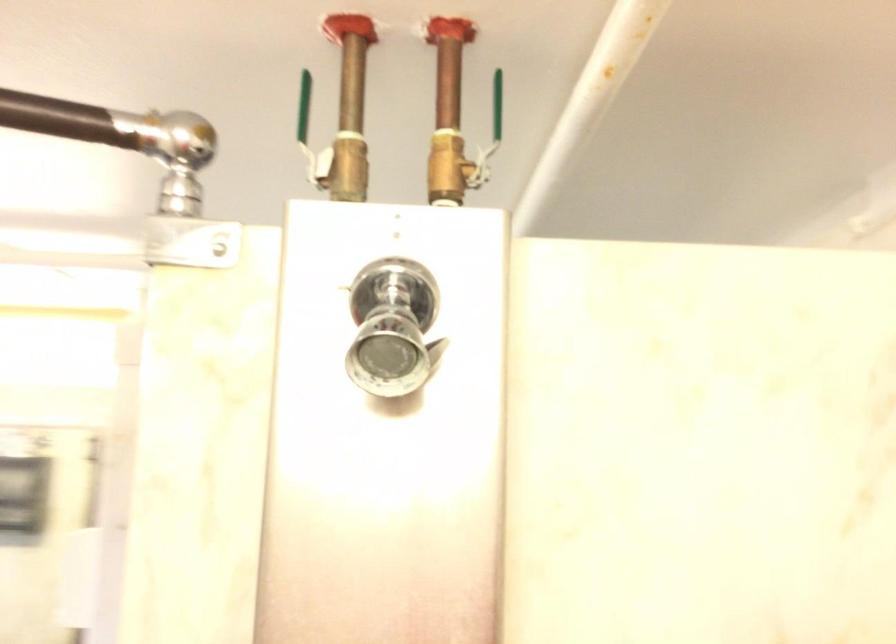
Locate an element on the screen. shower head lever is located at coordinates (392, 327).